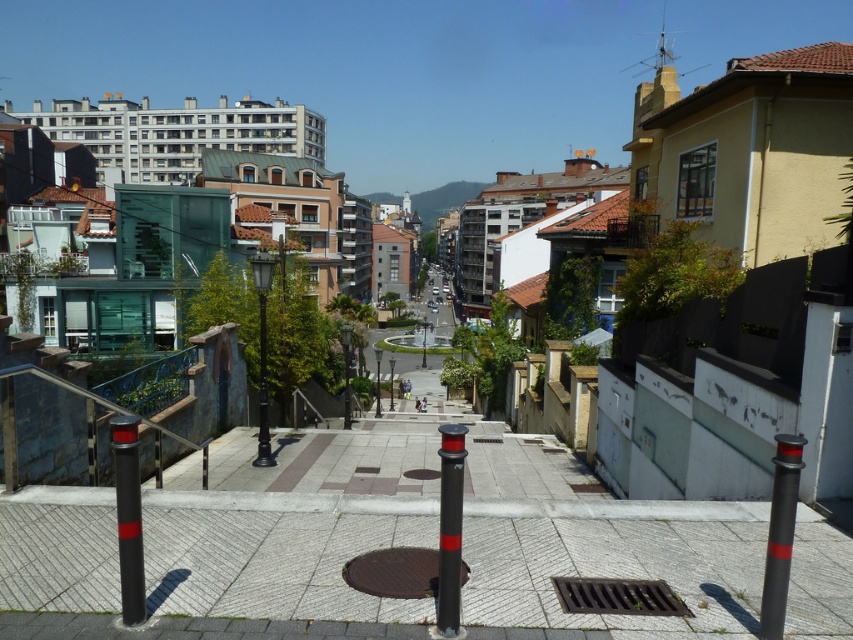
Is point (444, 538) closer to viewer compared to point (379, 353)?

Yes, it is.

Between point (447, 538) and point (376, 364), which one is positioned in front?

Point (447, 538) is more forward.

Looking at this image, measure the distance between black rubber pole at center and camera.

A distance of 3.67 meters exists between black rubber pole at center and camera.

Image resolution: width=853 pixels, height=640 pixels. What are the coordinates of `black rubber pole at center` in the screenshot? It's located at (450, 528).

Does black rubber pole at lower left appear over black rubber pole at center?

Yes, black rubber pole at lower left is above black rubber pole at center.

Does black rubber pole at lower left have a greater height compared to black rubber pole at center?

Incorrect, black rubber pole at lower left's height is not larger of black rubber pole at center's.

This screenshot has width=853, height=640. Identify the location of black rubber pole at lower left. (128, 516).

Is point (604, 531) behind point (378, 401)?

No, it is not.

Between smooth concrete pavement at center and black metal pole at center, which one has less height?

smooth concrete pavement at center is shorter.

Between point (573, 616) and point (378, 358), which one is positioned in front?

Positioned in front is point (573, 616).

Identify the location of smooth concrete pavement at center. The height and width of the screenshot is (640, 853). (614, 572).